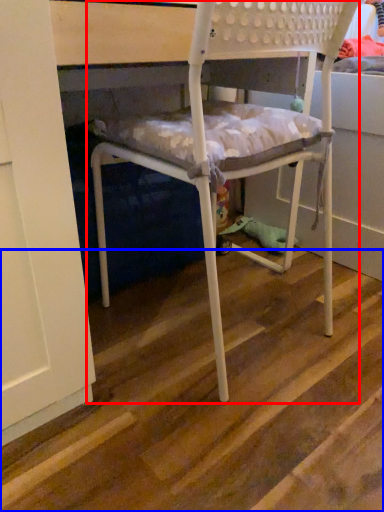
Question: Which point is closer to the camera, chair (highlighted by a red box) or stair (highlighted by a blue box)?

Choices:
 (A) chair
 (B) stair

Answer: (B)